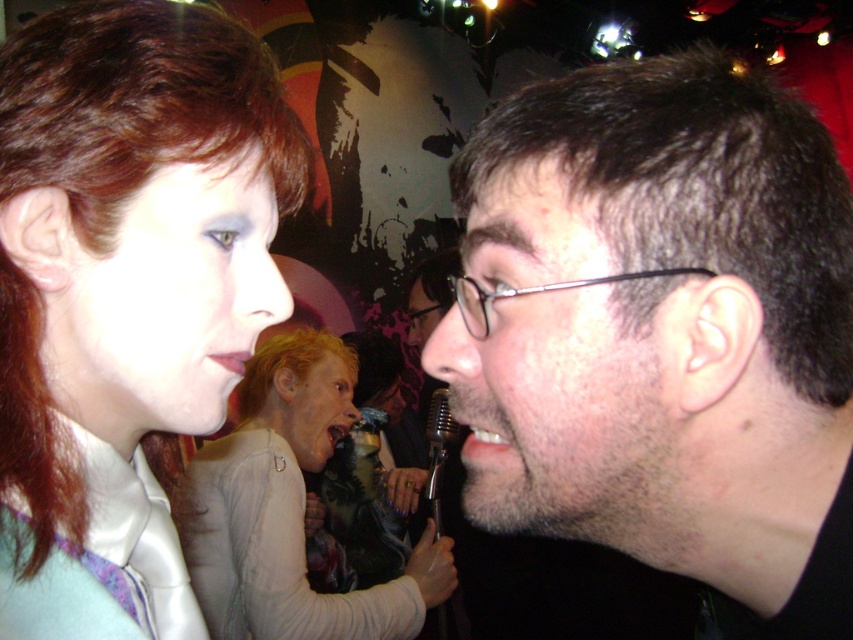
Question: Which point is closer to the camera?

Choices:
 (A) (312, 352)
 (B) (744, 419)

Answer: (B)

Question: Does satin white shirt at upper left have a greater width compared to light beige sweater at center?

Choices:
 (A) no
 (B) yes

Answer: (A)

Question: Can you confirm if dark brown hair at center is positioned below light beige sweater at center?

Choices:
 (A) no
 (B) yes

Answer: (A)

Question: Based on their relative distances, which object is nearer to the light beige sweater at center?

Choices:
 (A) metallic silver microphone at center
 (B) dark brown hair at center

Answer: (A)

Question: In this image, where is dark brown hair at center located relative to light beige sweater at center?

Choices:
 (A) left
 (B) right

Answer: (B)

Question: Which object appears farthest from the camera in this image?

Choices:
 (A) light beige sweater at center
 (B) dark brown hair at center
 (C) satin white shirt at upper left

Answer: (A)